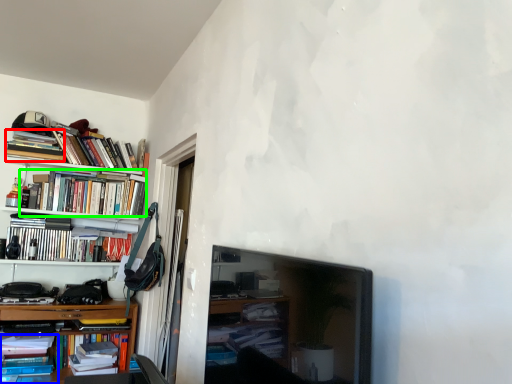
Question: Estimate the real-world distances between objects in this image. Which object is farther from book (highlighted by a red box), book (highlighted by a blue box) or book (highlighted by a green box)?

Choices:
 (A) book
 (B) book

Answer: (A)